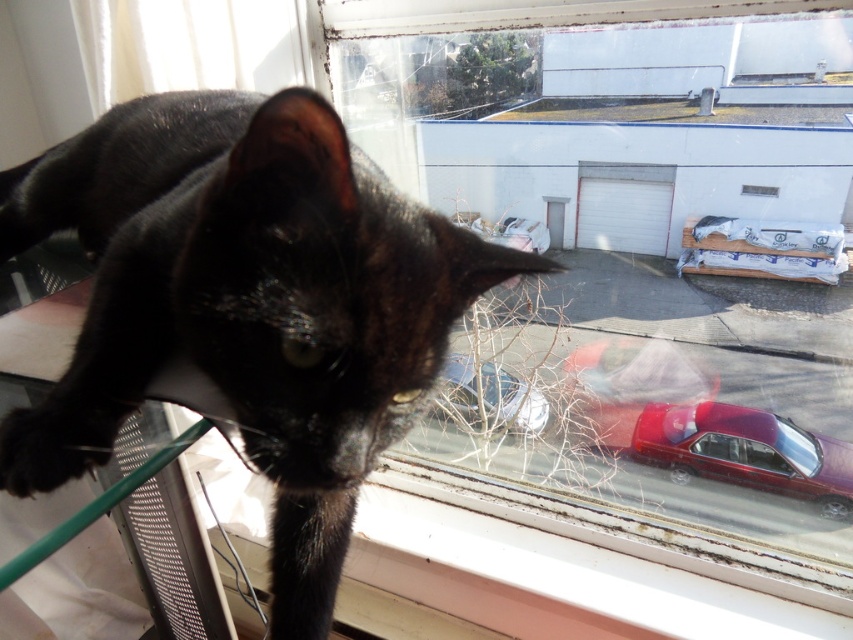
Who is positioned more to the left, black glossy cat at upper left or metallic silver car at lower center?

Positioned to the left is black glossy cat at upper left.

Does black glossy cat at upper left have a larger size compared to metallic silver car at lower center?

Correct, black glossy cat at upper left is larger in size than metallic silver car at lower center.

Between point (198, 132) and point (485, 396), which one is positioned in front?

Point (198, 132)

Identify the location of black glossy cat at upper left. (247, 304).

Can you confirm if shiny red car at lower right is positioned to the left of metallic silver car at lower center?

No, shiny red car at lower right is not to the left of metallic silver car at lower center.

Between shiny red car at lower right and metallic silver car at lower center, which one has less height?

With less height is metallic silver car at lower center.

Does point (618, 444) lie behind point (469, 410)?

Yes, it is behind point (469, 410).

You are a GUI agent. You are given a task and a screenshot of the screen. Output one action in this format:
    pyautogui.click(x=<x>, y=<y>)
    Task: Click on the shiny red car at lower right
    The image size is (853, 640).
    Given the screenshot: What is the action you would take?
    pyautogui.click(x=637, y=390)

Who is positioned more to the right, black glossy cat at upper left or shiny red car at lower right?

shiny red car at lower right is more to the right.

Which is in front, point (194, 176) or point (579, 394)?

Point (194, 176) is in front.

The width and height of the screenshot is (853, 640). Find the location of `black glossy cat at upper left`. black glossy cat at upper left is located at coordinates (247, 304).